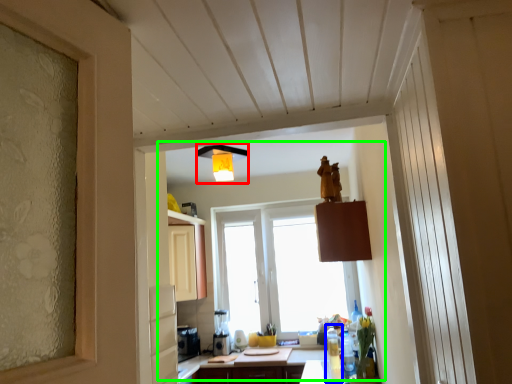
Question: Which is farther away from light fixture (highlighted by a red box)? bottle (highlighted by a blue box) or bay window (highlighted by a green box)?

Choices:
 (A) bottle
 (B) bay window

Answer: (A)